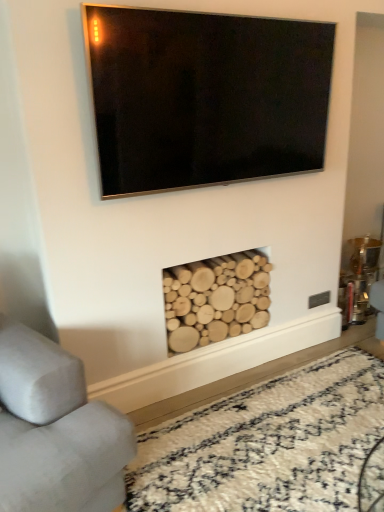
I want to click on free space above natural wood logs at lower center (from a real-world perspective), so click(288, 436).